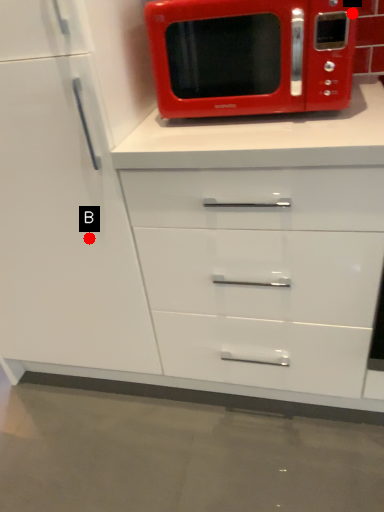
Question: Two points are circled on the image, labeled by A and B beside each circle. Which of the following is the farthest from the observer?

Choices:
 (A) A is further
 (B) B is further

Answer: (B)